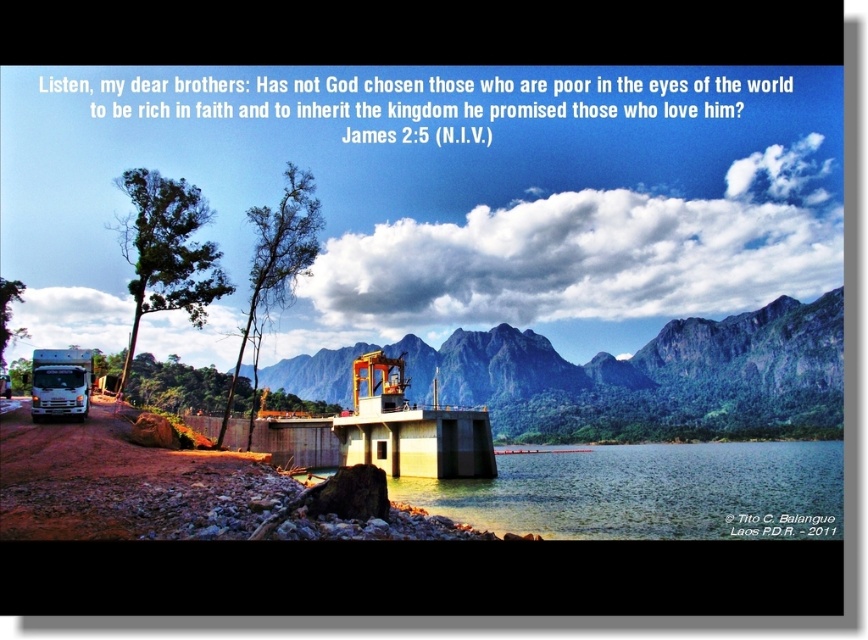
Who is lower down, clear water at lower center or white glossy truck at lower left?

Positioned lower is clear water at lower center.

Is point (816, 522) more distant than point (37, 412)?

Yes, point (816, 522) is farther from viewer.

Which is behind, point (678, 525) or point (67, 356)?

Point (67, 356)

Where is `clear water at lower center`? This screenshot has height=640, width=868. clear water at lower center is located at coordinates (649, 492).

Does green rock mountain at center appear over clear water at lower center?

Correct, green rock mountain at center is located above clear water at lower center.

Where is `green rock mountain at center`? The image size is (868, 640). green rock mountain at center is located at coordinates (653, 378).

At what (x,y) coordinates should I click in order to perform the action: click on green rock mountain at center. Please return your answer as a coordinate pair (x, y). Looking at the image, I should click on (653, 378).

Is green rock mountain at center further to camera compared to white glossy truck at lower left?

That is True.

How much distance is there between green rock mountain at center and white glossy truck at lower left?

A distance of 1451.20 feet exists between green rock mountain at center and white glossy truck at lower left.

Who is more forward, (788, 348) or (38, 413)?

Point (38, 413)

Where is `green rock mountain at center`? This screenshot has height=640, width=868. green rock mountain at center is located at coordinates (653, 378).